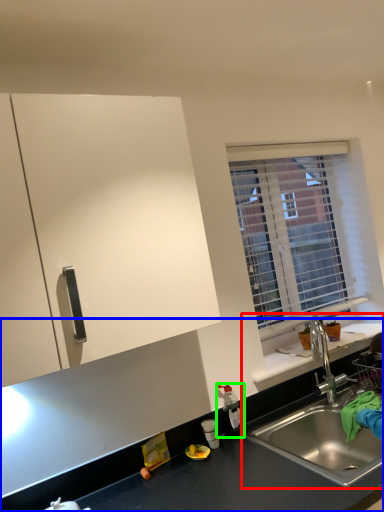
Question: Estimate the real-world distances between objects in this image. Which object is closer to sink (highlighted by a red box), countertop (highlighted by a blue box) or bottle (highlighted by a green box)?

Choices:
 (A) countertop
 (B) bottle

Answer: (A)